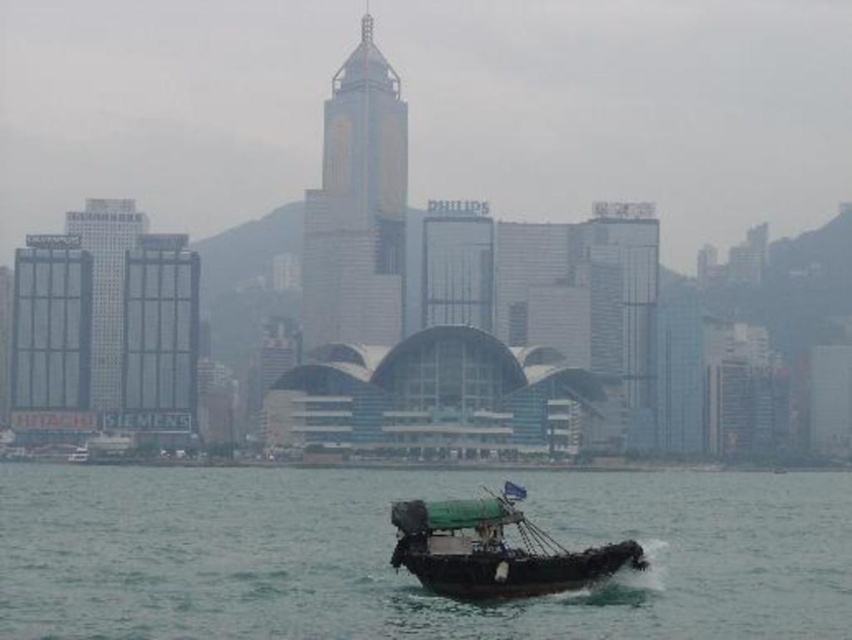
You are standing at the waterfront and see the green rubber boat at lower center. If you want to take a photo of it with your smartphone, which has a maximum zoom range of 10x, will you be able to capture the boat clearly without moving closer?

The green rubber boat at lower center is 507.52 meters away from the camera. Since smartphones typically cannot zoom effectively beyond 10x at such distances, capturing the boat clearly without moving closer would be difficult.

You are a photographer standing on the dock and want to capture both the green rubber boat at lower center and the green canvas boat at lower center in the same frame. Which boat will appear taller in your photo?

The green rubber boat at lower center will appear taller in the photo because it is much taller than the green canvas boat at lower center according to the description.